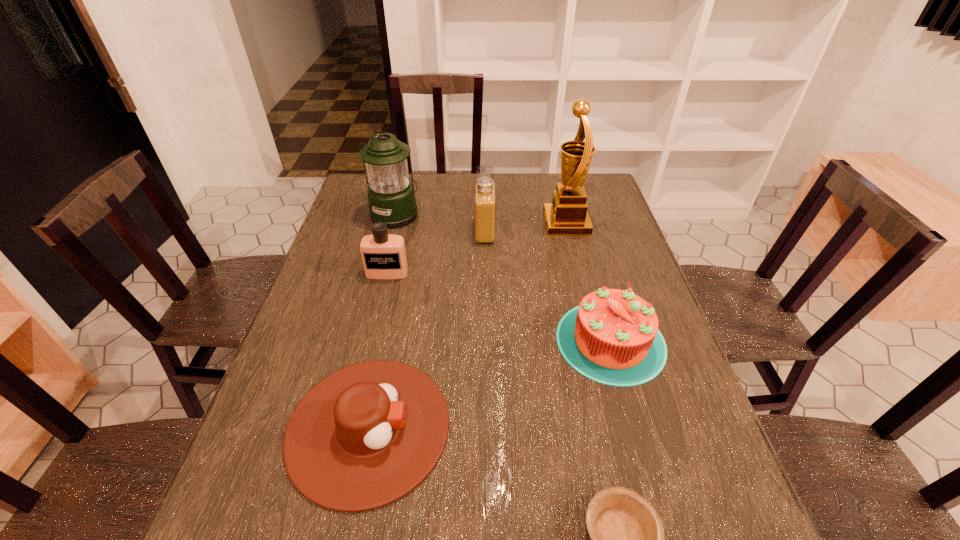
Locate an element on the screen. award is located at coordinates (567, 215).

The height and width of the screenshot is (540, 960). Find the location of `the sixth shortest object`. the sixth shortest object is located at coordinates (391, 197).

This screenshot has height=540, width=960. In order to click on the third tallest object in this screenshot , I will do `click(485, 198)`.

The height and width of the screenshot is (540, 960). What are the coordinates of `the farther perfume` in the screenshot? It's located at (485, 198).

The width and height of the screenshot is (960, 540). I want to click on the shorter perfume, so click(x=383, y=255).

Where is `the nearer perfume`? This screenshot has height=540, width=960. the nearer perfume is located at coordinates (383, 255).

Locate an element on the screen. The height and width of the screenshot is (540, 960). cake is located at coordinates (612, 337).

Locate an element on the screen. the sixth tallest object is located at coordinates (365, 436).

Identify the location of vacant point located on the front-facing side of the tallest object. The image size is (960, 540). (459, 223).

The height and width of the screenshot is (540, 960). Find the location of `vacant region located on the front-facing side of the tallest object`. vacant region located on the front-facing side of the tallest object is located at coordinates (526, 223).